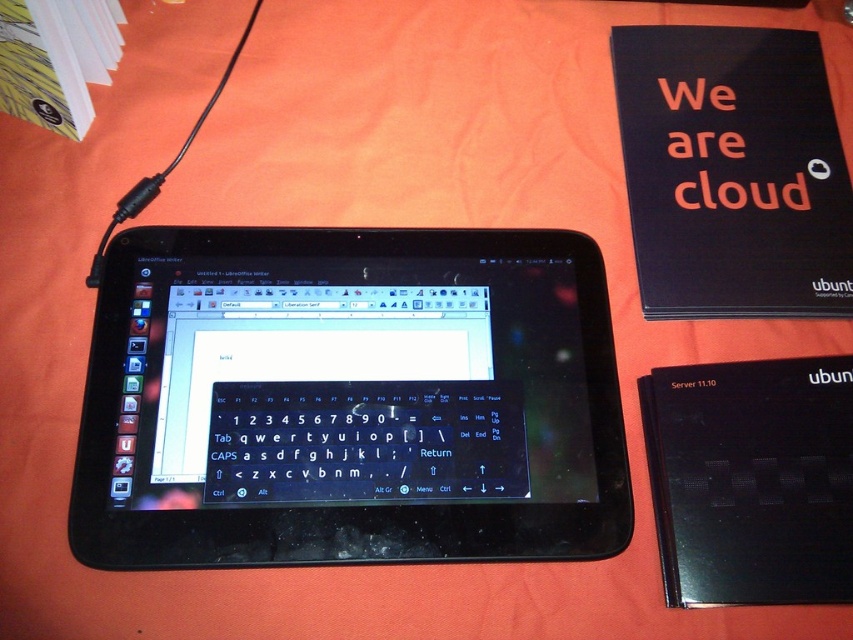
Question: Which of the following is the farthest from the observer?

Choices:
 (A) (711, 497)
 (B) (554, 314)

Answer: (B)

Question: Which point is closer to the camera?

Choices:
 (A) black matte tablet at center
 (B) black plastic tablet at center

Answer: (A)

Question: Does black plastic tablet at center appear on the right side of black matte tablet at center?

Choices:
 (A) no
 (B) yes

Answer: (A)

Question: Is black plastic tablet at center bigger than black matte tablet at center?

Choices:
 (A) no
 (B) yes

Answer: (B)

Question: Does black plastic tablet at center have a smaller size compared to black matte tablet at center?

Choices:
 (A) yes
 (B) no

Answer: (B)